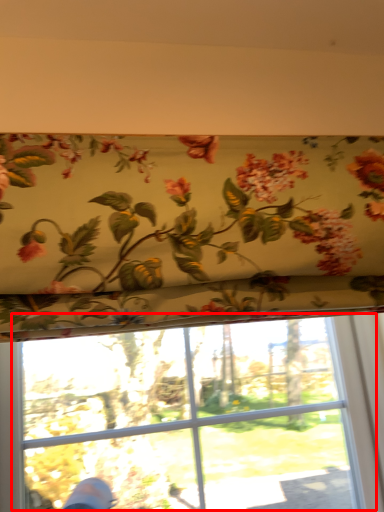
Question: Where is bay window (annotated by the red box) located in relation to floral arrangement in the image?

Choices:
 (A) left
 (B) right

Answer: (A)